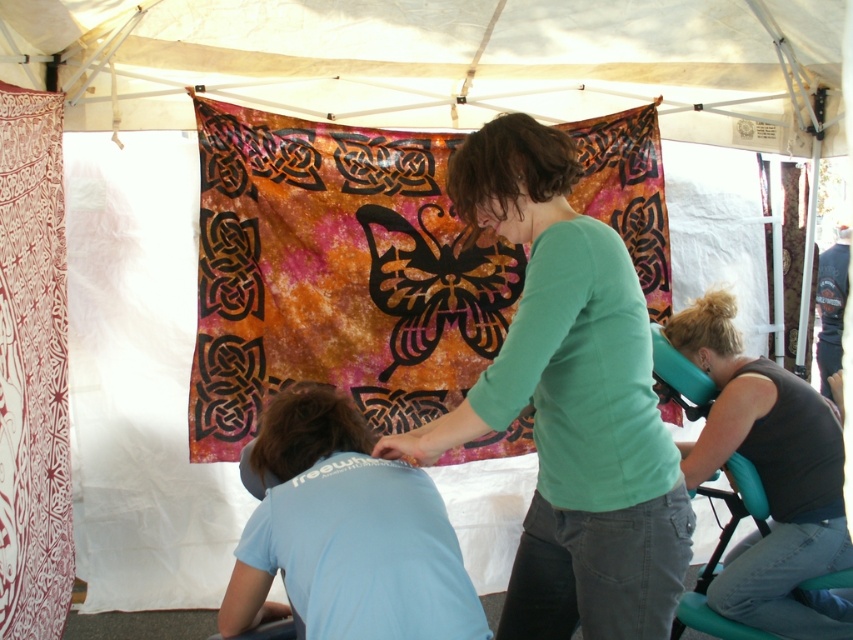
You are a photographer positioned to the left of the scene. You need to capture a photo that includes both the green matte shirt at center and the teal plastic chair at lower right. Which object should you adjust your camera angle to focus on first to ensure both are in frame?

The green matte shirt at center is above the teal plastic chair at lower right. To ensure both are in frame, focus on the higher positioned green matte shirt at center first, then adjust the camera angle downward to include the teal plastic chair at lower right.

You are a photographer positioned at the front of the scene. You want to take a photo of the green matte shirt at center and brown matte hair at center such that both are fully visible. Considering their widths, is it possible to frame them without cropping either object?

The green matte shirt at center might be wider than brown matte hair at center. Since the exact width comparison is uncertain, it is possible that the green matte shirt at center could occupy more space, but without knowing the exact dimensions, it is advisable to position the camera to include both objects fully in the frame.